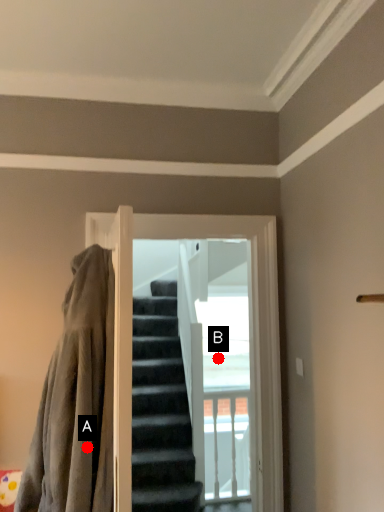
Question: Two points are circled on the image, labeled by A and B beside each circle. Which point is closer to the camera?

Choices:
 (A) A is closer
 (B) B is closer

Answer: (A)